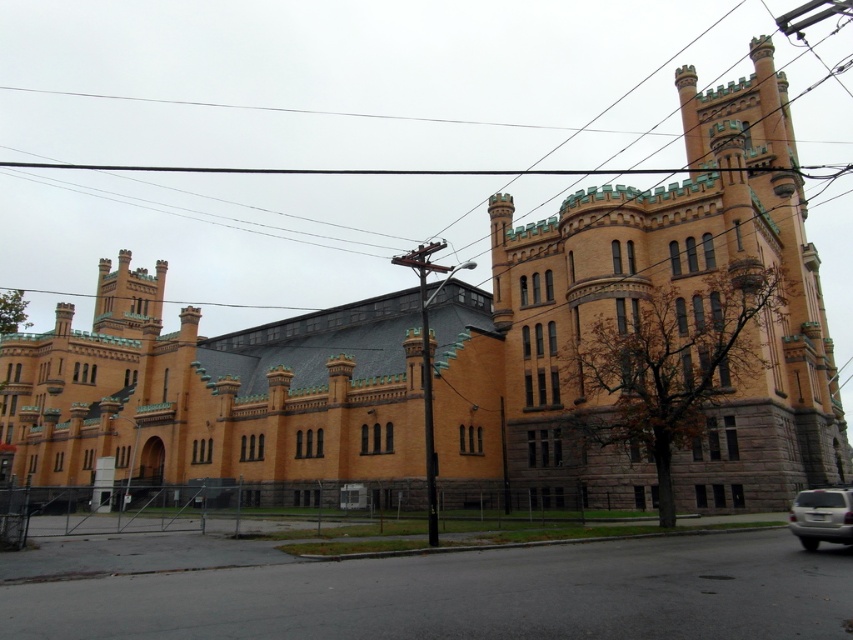
You are standing in front of the large ornate building and notice the silver metallic suv at lower right and the black wire at upper center. Which object is closer to you?

The silver metallic suv at lower right is behind the black wire at upper center, so the black wire at upper center is closer to you.

You are standing in front of the large ornate building and notice two objects in the scene. Which object is positioned to the left of the other? The objects are the black wire at upper center and the silver metallic suv at lower right.

The black wire at upper center is positioned to the left of the silver metallic suv at lower right.